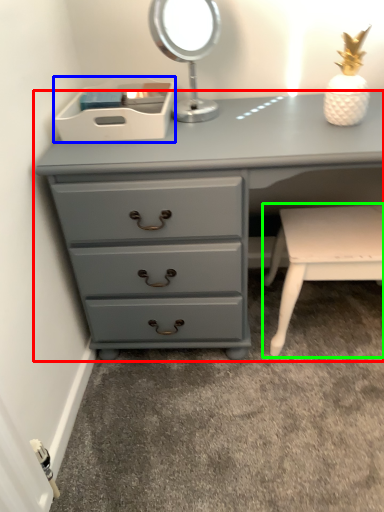
Question: Which is farther away from chest of drawers (highlighted by a red box)? storage box (highlighted by a blue box) or table (highlighted by a green box)?

Choices:
 (A) storage box
 (B) table

Answer: (B)